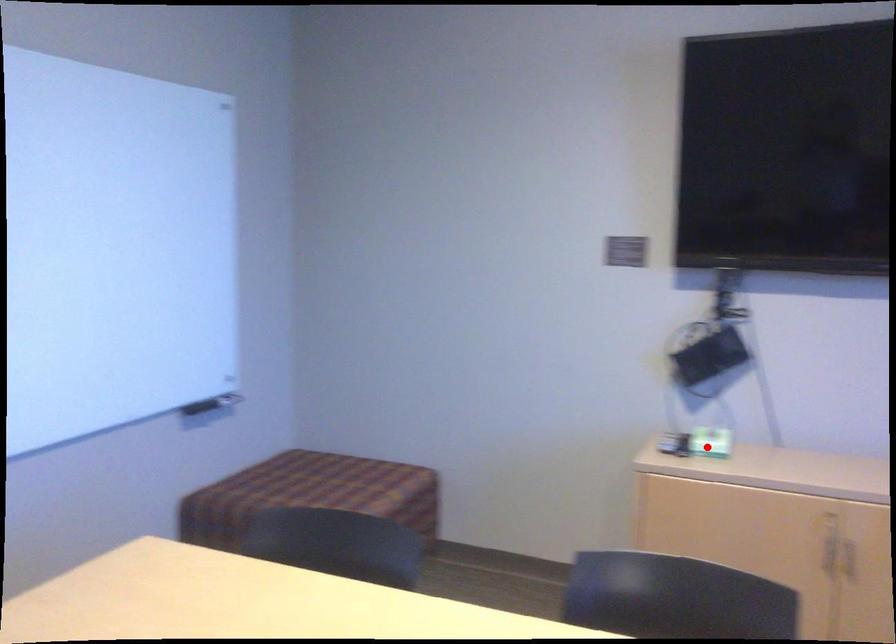
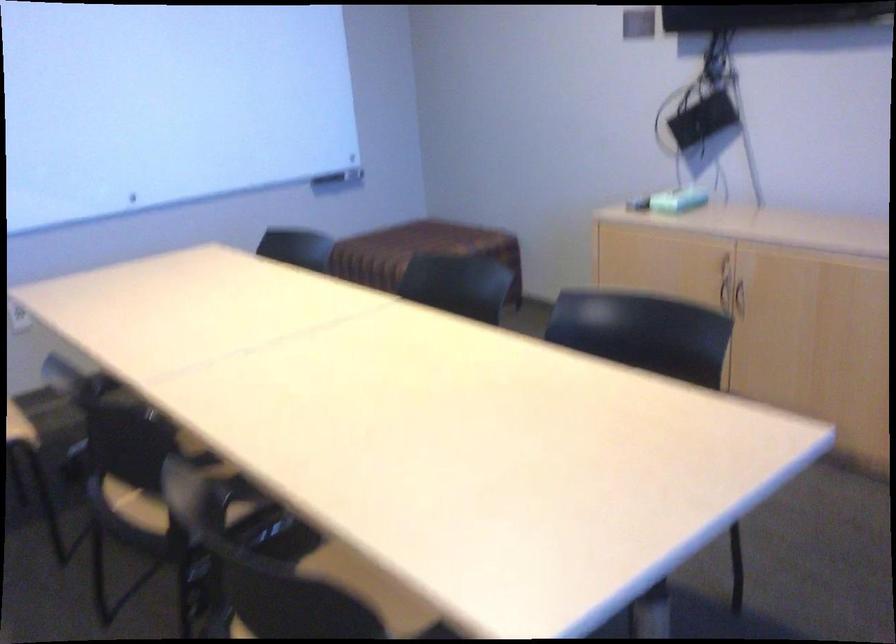
The point at the highlighted location is marked in the first image. Where is the corresponding point in the second image?

(677, 200)